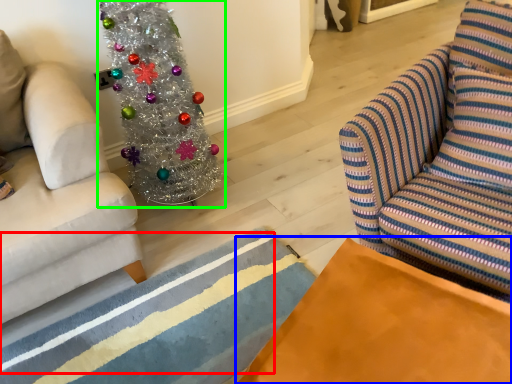
Question: Which is farther away from stripe (highlighted by a red box)? table (highlighted by a blue box) or christmas tree (highlighted by a green box)?

Choices:
 (A) table
 (B) christmas tree

Answer: (A)